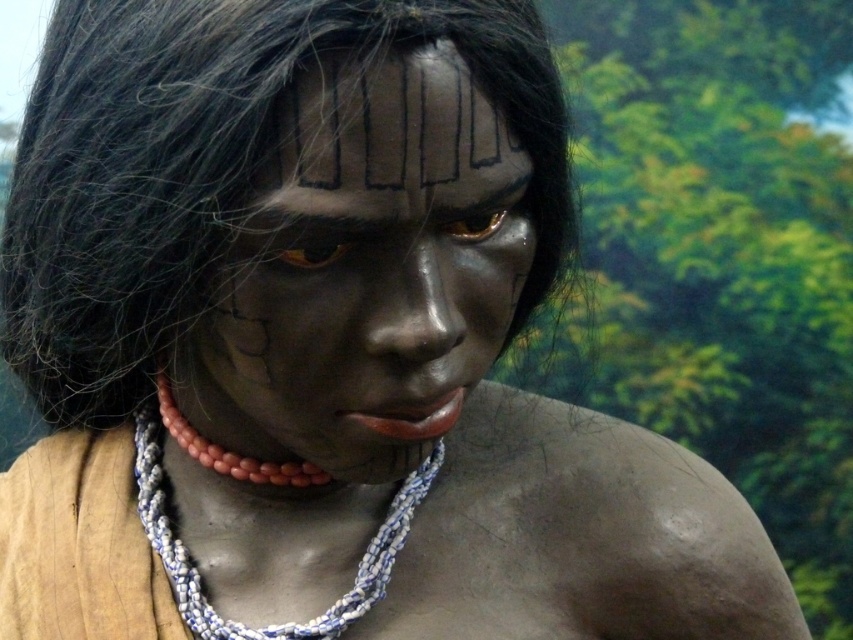
Does black matte forehead at center have a smaller size compared to blue and white beaded necklace at center?

Indeed, black matte forehead at center has a smaller size compared to blue and white beaded necklace at center.

Can you confirm if black matte forehead at center is positioned to the right of blue and white beaded necklace at center?

Yes, black matte forehead at center is to the right of blue and white beaded necklace at center.

Measure the distance between point (386, 88) and camera.

Point (386, 88) and camera are 25.64 inches apart.

Identify the location of black matte forehead at center. The height and width of the screenshot is (640, 853). (392, 129).

Can you confirm if matte black face at center is wider than black matte forehead at center?

Yes, matte black face at center is wider than black matte forehead at center.

Who is more distant from viewer, (384,308) or (474,148)?

Positioned behind is point (384,308).

Is point (404, 385) farther from camera compared to point (494, 152)?

Yes, point (404, 385) is farther from viewer.

Image resolution: width=853 pixels, height=640 pixels. Find the location of `matte black face at center`. matte black face at center is located at coordinates (367, 268).

Can you confirm if matte black face at center is positioned to the right of blue and white beaded necklace at center?

Indeed, matte black face at center is positioned on the right side of blue and white beaded necklace at center.

Can you confirm if matte black face at center is wider than blue and white beaded necklace at center?

No, matte black face at center is not wider than blue and white beaded necklace at center.

Is point (505, 128) farther from camera compared to point (148, 509)?

No, it is not.

This screenshot has height=640, width=853. I want to click on matte black face at center, so click(367, 268).